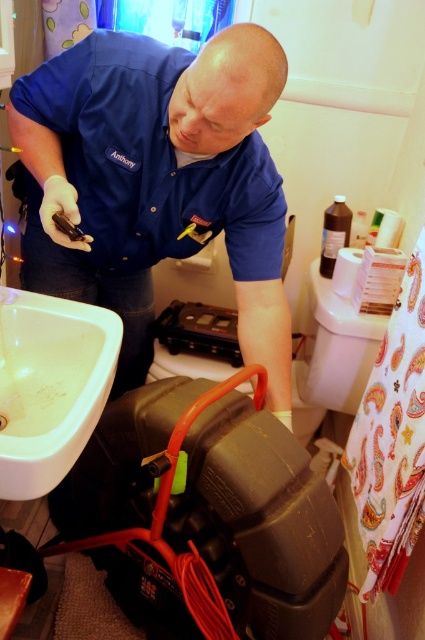
You are a customer in a bathroom and need to reach the white glossy sink at lower left to wash your hands. However, there is a blue uniform shirt at upper center blocking your view. Can you still access the sink without moving the shirt?

The blue uniform shirt at upper center is positioned over the white glossy sink at lower left, so the shirt is blocking access to the sink. You would need to move the shirt to reach the sink.

You are a customer in a bathroom and need to reach the white glossy sink at lower left to wash your hands. There is a blue uniform shirt at upper center in your way. Can you move around it to access the sink?

The blue uniform shirt at upper center has a greater height compared to the white glossy sink at lower left, so it might block your path. Move to the side of the blue uniform shirt at upper center to access the white glossy sink at lower left.

Looking at this image, what are the coordinates of the blue uniform shirt at upper center in the image?

The coordinates of the blue uniform shirt at upper center are at point (158, 180).